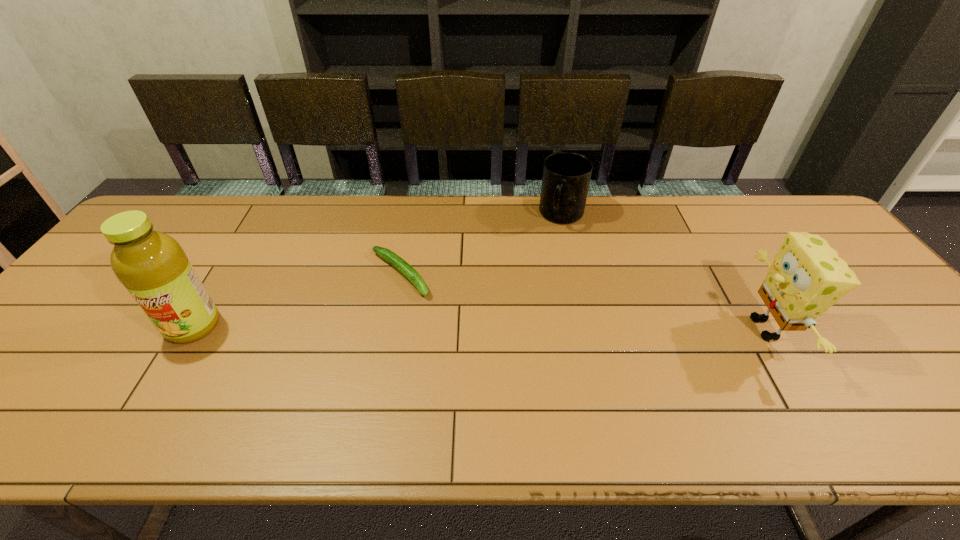
What are the coordinates of `fruit juice` in the screenshot? It's located at (153, 267).

Find the location of a particular element. Image resolution: width=960 pixels, height=540 pixels. the tallest object is located at coordinates (153, 267).

Where is `the rightmost object`? Image resolution: width=960 pixels, height=540 pixels. the rightmost object is located at coordinates (807, 276).

The width and height of the screenshot is (960, 540). I want to click on the third shortest object, so click(x=807, y=276).

At what (x,y) coordinates should I click in order to perform the action: click on the third object from right to left. Please return your answer as a coordinate pair (x, y). The width and height of the screenshot is (960, 540). Looking at the image, I should click on (397, 262).

This screenshot has height=540, width=960. Find the location of `zucchini`. zucchini is located at coordinates (397, 262).

The width and height of the screenshot is (960, 540). In order to click on the second shortest object in this screenshot , I will do `click(566, 177)`.

Find the location of a particular element. mug is located at coordinates (566, 177).

The width and height of the screenshot is (960, 540). I want to click on vacant area situated on the front label of the leftmost object, so click(x=158, y=384).

This screenshot has width=960, height=540. Identify the location of blank space located 0.210m on the face of the rightmost object. (657, 328).